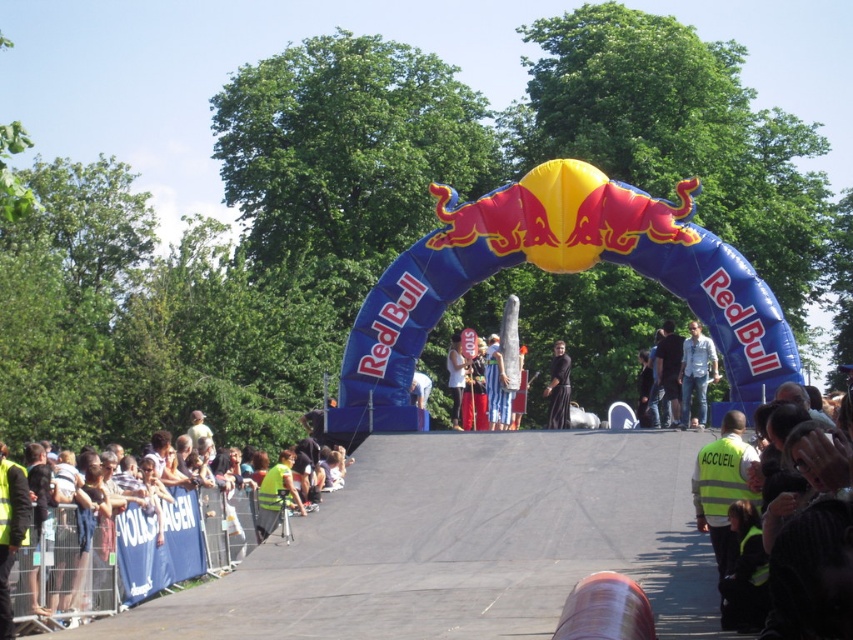
Can you confirm if yellow reflective vests at lower left is taller than black cloth at center?

Yes, yellow reflective vests at lower left is taller than black cloth at center.

Does yellow reflective vests at lower left lie in front of black cloth at center?

Yes, yellow reflective vests at lower left is closer to the viewer.

Find the location of a particular element. yellow reflective vests at lower left is located at coordinates (132, 552).